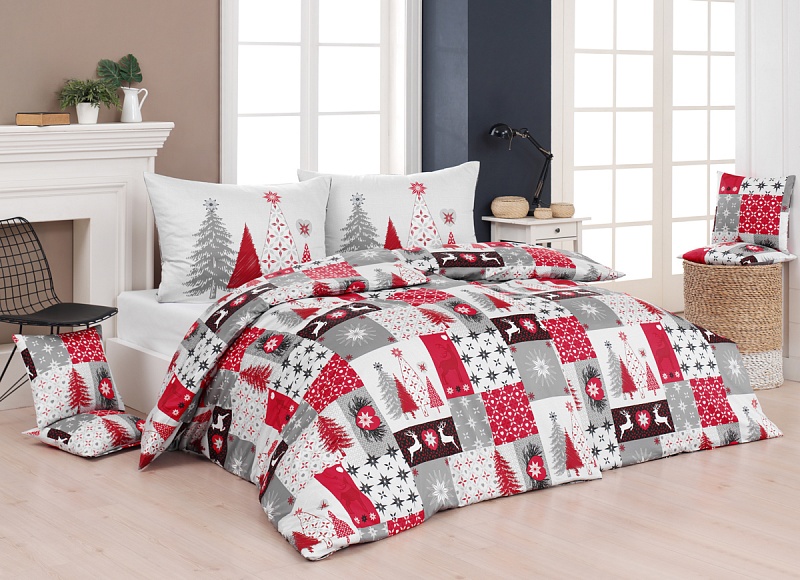
At what (x,y) coordinates should I click in order to perform the action: click on black desk lamp. Please return your answer as a coordinate pair (x, y). The image size is (800, 580). Looking at the image, I should click on (534, 142).